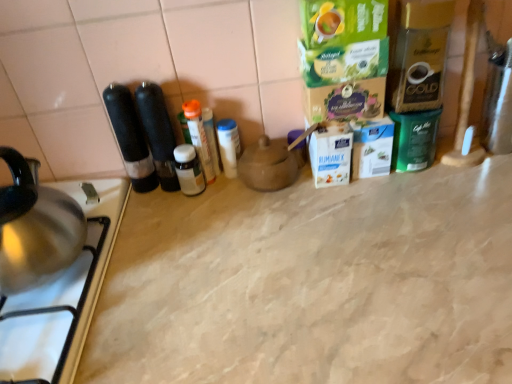
Identify the location of free point in front of white glossy bottle at center, which is the third bottle from right to left. (197, 250).